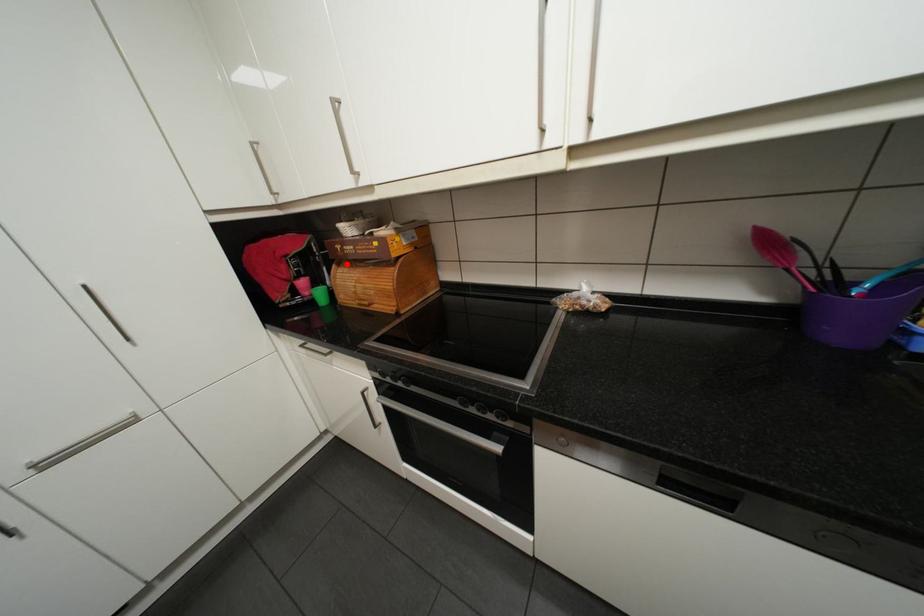
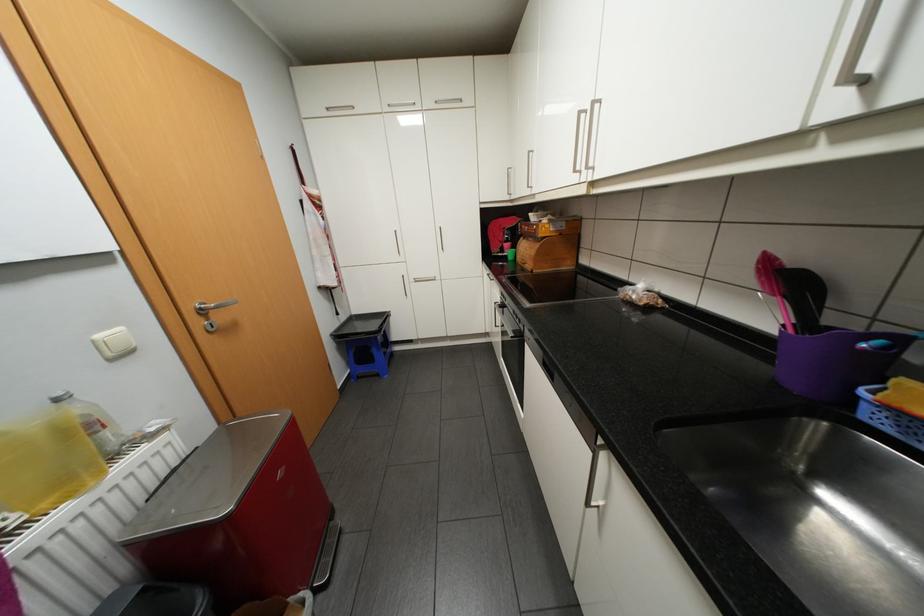
Where in the second image is the point corresponding to the highlighted location from the first image?

(531, 237)